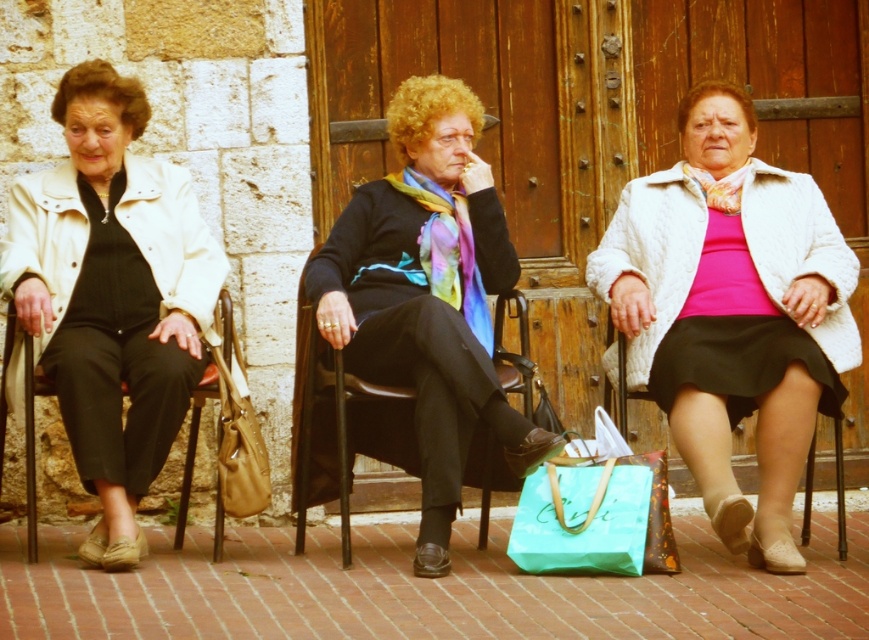
Question: Which point is farther to the camera?

Choices:
 (A) (722, 150)
 (B) (242, 413)
 (C) (32, 352)

Answer: (A)

Question: Which of these objects is positioned closest to the teal fabric shopping bag at center?

Choices:
 (A) white textured coat at center
 (B) leather handbag at lower left

Answer: (A)

Question: Can you confirm if black leather chair at center is thinner than teal fabric shopping bag at center?

Choices:
 (A) yes
 (B) no

Answer: (A)

Question: Which point is closer to the camera?

Choices:
 (A) metallic silver chair at center
 (B) white textured coat at center
 (C) metallic brown chair at left

Answer: (B)

Question: Is white textured coat at center thinner than leather handbag at lower left?

Choices:
 (A) yes
 (B) no

Answer: (B)

Question: Is white textured coat at center wider than metallic silver chair at center?

Choices:
 (A) no
 (B) yes

Answer: (B)